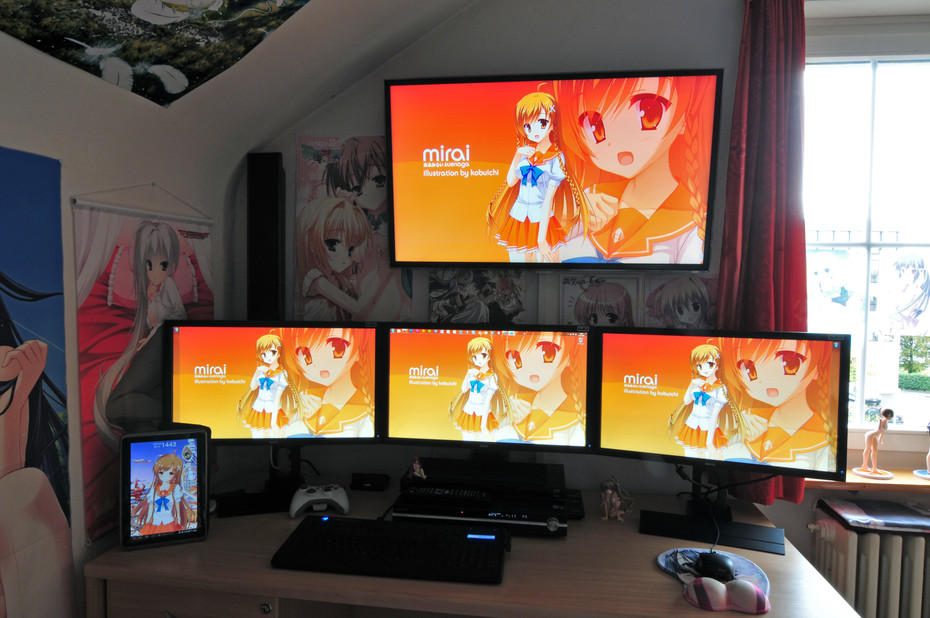
Locate an element on the screen. The height and width of the screenshot is (618, 930). mouse is located at coordinates (711, 570).